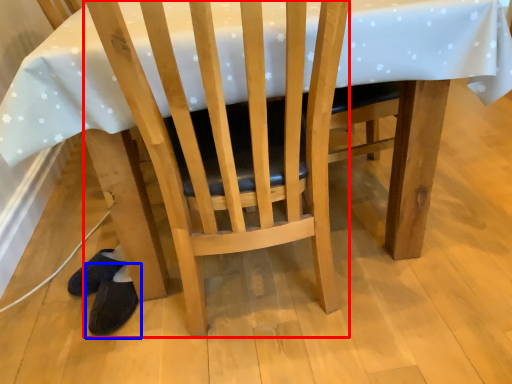
Question: Which object is further to the camera taking this photo, chair (highlighted by a red box) or footwear (highlighted by a blue box)?

Choices:
 (A) chair
 (B) footwear

Answer: (B)